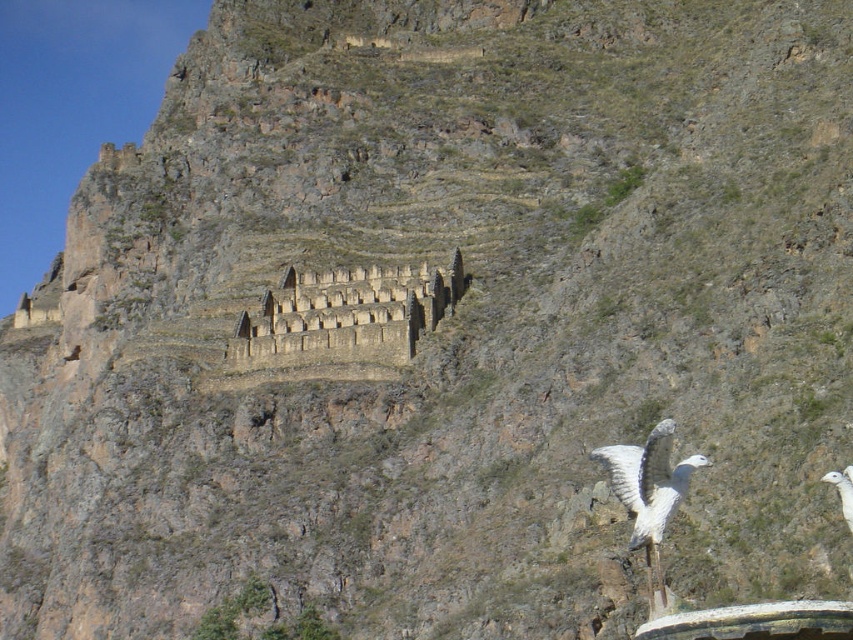
Which is above, stone/rough stone structure at center or white matte bird at lower right?

stone/rough stone structure at center is higher up.

Who is lower down, stone/rough stone structure at center or white matte bird at lower right?

white matte bird at lower right

Where is `stone/rough stone structure at center`? stone/rough stone structure at center is located at coordinates (343, 316).

Is stone/rough stone structure at center positioned behind white feathered bird at lower right?

Yes, it is.

Which is in front, point (412, 337) or point (657, 481)?

Point (657, 481) is in front.

The image size is (853, 640). In order to click on stone/rough stone structure at center in this screenshot , I will do `click(343, 316)`.

Describe the element at coordinates (648, 490) in the screenshot. This screenshot has height=640, width=853. I see `white feathered bird at lower right` at that location.

Is white feathered bird at lower right wider than white matte bird at lower right?

Correct, the width of white feathered bird at lower right exceeds that of white matte bird at lower right.

The width and height of the screenshot is (853, 640). Describe the element at coordinates (648, 490) in the screenshot. I see `white feathered bird at lower right` at that location.

Find the location of a particular element. The width and height of the screenshot is (853, 640). white feathered bird at lower right is located at coordinates (648, 490).